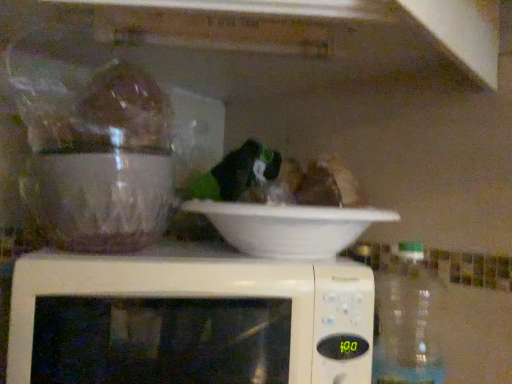
Question: Considering the relative positions of transparent plastic bottle at right and white matte bowl at center in the image provided, is transparent plastic bottle at right to the right of white matte bowl at center from the viewer's perspective?

Choices:
 (A) yes
 (B) no

Answer: (A)

Question: Does transparent plastic bottle at right have a larger size compared to white matte bowl at center?

Choices:
 (A) no
 (B) yes

Answer: (A)

Question: Could you tell me if transparent plastic bottle at right is facing white matte bowl at center?

Choices:
 (A) no
 (B) yes

Answer: (A)

Question: Is transparent plastic bottle at right taller than white matte bowl at center?

Choices:
 (A) no
 (B) yes

Answer: (B)

Question: Considering the relative sizes of transparent plastic bottle at right and white matte bowl at center in the image provided, is transparent plastic bottle at right wider than white matte bowl at center?

Choices:
 (A) yes
 (B) no

Answer: (B)

Question: Is transparent plastic bottle at right far from white matte bowl at center?

Choices:
 (A) yes
 (B) no

Answer: (B)

Question: Is transparent plastic bottle at right thinner than white plastic microwave at center?

Choices:
 (A) no
 (B) yes

Answer: (B)

Question: Are transparent plastic bottle at right and white plastic microwave at center located far from each other?

Choices:
 (A) yes
 (B) no

Answer: (B)

Question: Can you confirm if transparent plastic bottle at right is shorter than white plastic microwave at center?

Choices:
 (A) yes
 (B) no

Answer: (B)

Question: Considering the relative sizes of transparent plastic bottle at right and white plastic microwave at center in the image provided, is transparent plastic bottle at right bigger than white plastic microwave at center?

Choices:
 (A) no
 (B) yes

Answer: (A)

Question: From the image's perspective, is transparent plastic bottle at right located beneath white plastic microwave at center?

Choices:
 (A) yes
 (B) no

Answer: (A)

Question: Would you say transparent plastic bottle at right is outside white plastic microwave at center?

Choices:
 (A) no
 (B) yes

Answer: (B)

Question: From the image's perspective, does white plastic microwave at center appear higher than transparent plastic bottle at right?

Choices:
 (A) no
 (B) yes

Answer: (B)